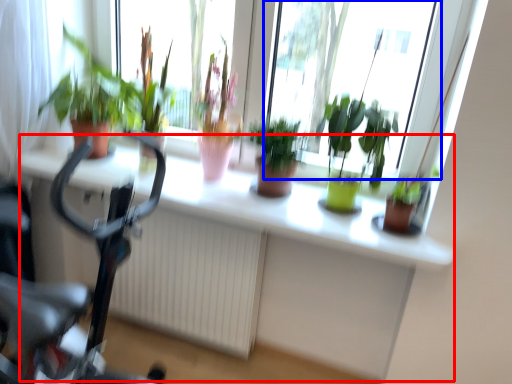
Question: Which object is further to the camera taking this photo, computer desk (highlighted by a red box) or bay window (highlighted by a blue box)?

Choices:
 (A) computer desk
 (B) bay window

Answer: (B)